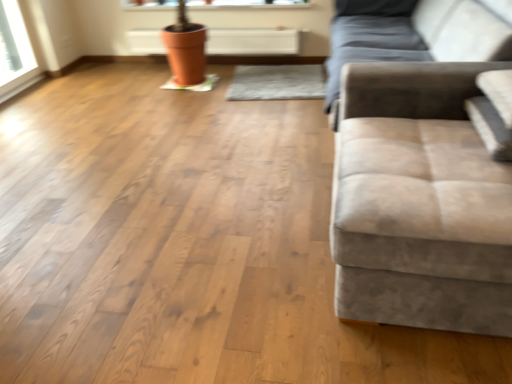
Question: Can you confirm if suede-like beige studio couch at right is taller than orange clay pot at upper center?

Choices:
 (A) yes
 (B) no

Answer: (A)

Question: Is suede-like beige studio couch at right far away from orange clay pot at upper center?

Choices:
 (A) yes
 (B) no

Answer: (A)

Question: Considering the relative sizes of suede-like beige studio couch at right and orange clay pot at upper center in the image provided, is suede-like beige studio couch at right shorter than orange clay pot at upper center?

Choices:
 (A) no
 (B) yes

Answer: (A)

Question: Can you confirm if suede-like beige studio couch at right is positioned to the right of orange clay pot at upper center?

Choices:
 (A) yes
 (B) no

Answer: (A)

Question: Is the position of suede-like beige studio couch at right more distant than that of orange clay pot at upper center?

Choices:
 (A) yes
 (B) no

Answer: (B)

Question: In terms of size, does white glossy window sill at upper center appear bigger or smaller than orange clay pot at upper center?

Choices:
 (A) big
 (B) small

Answer: (B)

Question: Is point (202, 8) closer or farther from the camera than point (153, 44)?

Choices:
 (A) farther
 (B) closer

Answer: (B)

Question: Is white glossy window sill at upper center to the left or to the right of orange clay pot at upper center in the image?

Choices:
 (A) right
 (B) left

Answer: (B)

Question: From a real-world perspective, relative to orange clay pot at upper center, is white glossy window sill at upper center vertically above or below?

Choices:
 (A) above
 (B) below

Answer: (A)

Question: Is suede-like beige studio couch at right inside or outside of orange clay pot at upper center?

Choices:
 (A) inside
 (B) outside

Answer: (B)

Question: Considering the relative positions of suede-like beige studio couch at right and orange clay pot at upper center in the image provided, is suede-like beige studio couch at right to the left or to the right of orange clay pot at upper center?

Choices:
 (A) right
 (B) left

Answer: (A)

Question: Is point (384, 208) closer or farther from the camera than point (214, 34)?

Choices:
 (A) farther
 (B) closer

Answer: (B)

Question: From the image's perspective, relative to orange clay pot at upper center, is suede-like beige studio couch at right above or below?

Choices:
 (A) above
 (B) below

Answer: (B)

Question: From a real-world perspective, is orange clay pot at upper center physically located above or below white glossy window sill at upper center?

Choices:
 (A) below
 (B) above

Answer: (A)

Question: Relative to white glossy window sill at upper center, is orange clay pot at upper center in front or behind?

Choices:
 (A) front
 (B) behind

Answer: (A)